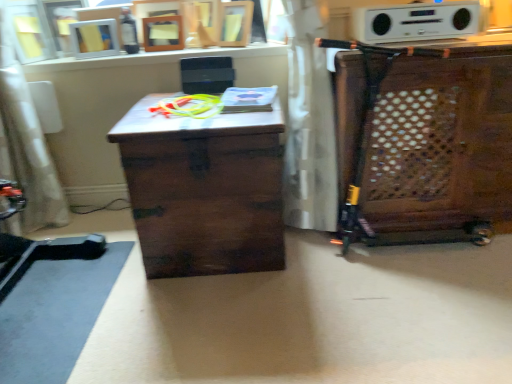
Locate an element on the screen. free location in front of dark wood trunk at center is located at coordinates (213, 320).